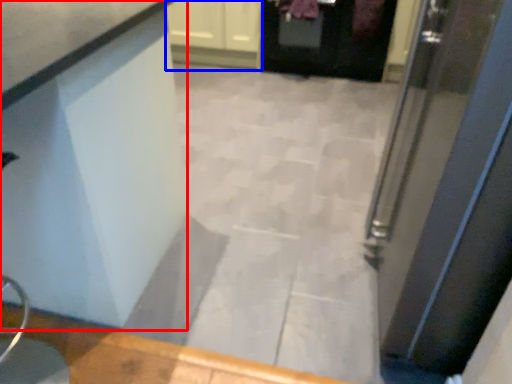
Question: Which object is further to the camera taking this photo, counter (highlighted by a red box) or cabinetry (highlighted by a blue box)?

Choices:
 (A) counter
 (B) cabinetry

Answer: (B)